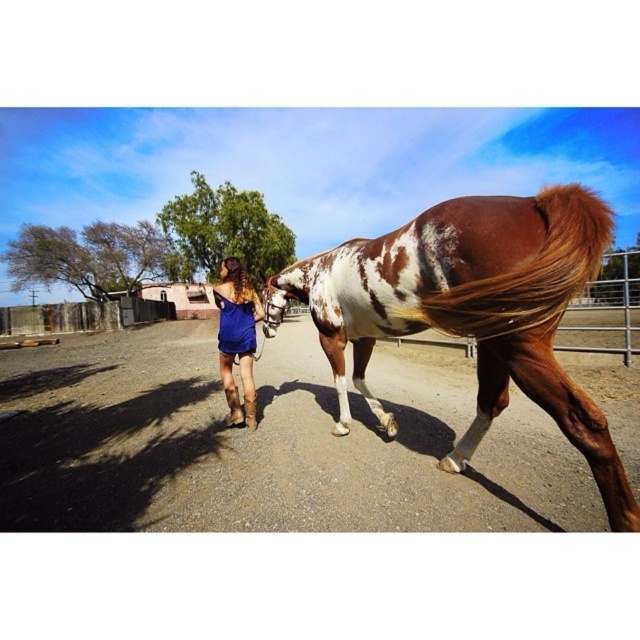
Is brown speckled horse at center wider than brown silky tail at right?

Yes, brown speckled horse at center is wider than brown silky tail at right.

Does brown speckled horse at center have a lesser height compared to brown silky tail at right?

Incorrect, brown speckled horse at center's height does not fall short of brown silky tail at right's.

Between point (504, 204) and point (449, 323), which one is positioned behind?

The point (449, 323) is behind.

At what (x,y) coordinates should I click in order to perform the action: click on brown speckled horse at center. Please return your answer as a coordinate pair (x, y). Image resolution: width=640 pixels, height=640 pixels. Looking at the image, I should click on (470, 310).

Is brown gravel dirt track at center further to camera compared to blue satin dress at center?

No, it is not.

Does point (541, 448) come in front of point (252, 406)?

Yes, it is in front of point (252, 406).

Identify the location of brown gravel dirt track at center. (264, 444).

Is brown speckled horse at center bigger than blue satin dress at center?

Yes.

Who is lower down, brown speckled horse at center or blue satin dress at center?

blue satin dress at center

Identify the location of brown speckled horse at center. This screenshot has width=640, height=640. (470, 310).

Identify the location of brown speckled horse at center. This screenshot has width=640, height=640. (470, 310).